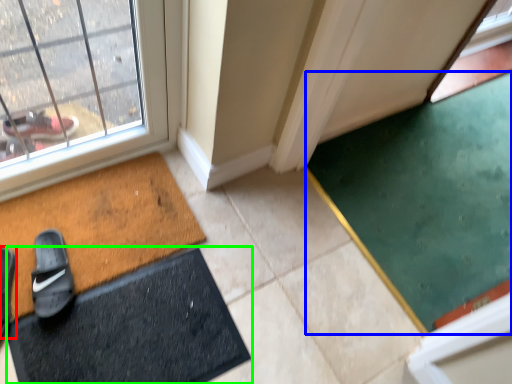
Question: Considering the real-world distances, which object is farthest from footwear (highlighted by a red box)? doormat (highlighted by a blue box) or bath mat (highlighted by a green box)?

Choices:
 (A) doormat
 (B) bath mat

Answer: (A)